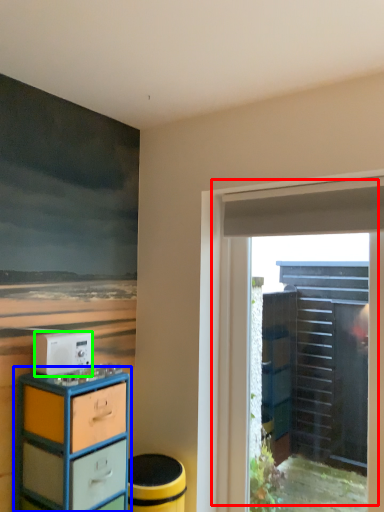
Question: Based on their relative distances, which object is farther from door (highlighted by a red box)? Choose from chest of drawers (highlighted by a blue box) and appliance (highlighted by a green box).

Choices:
 (A) chest of drawers
 (B) appliance

Answer: (B)